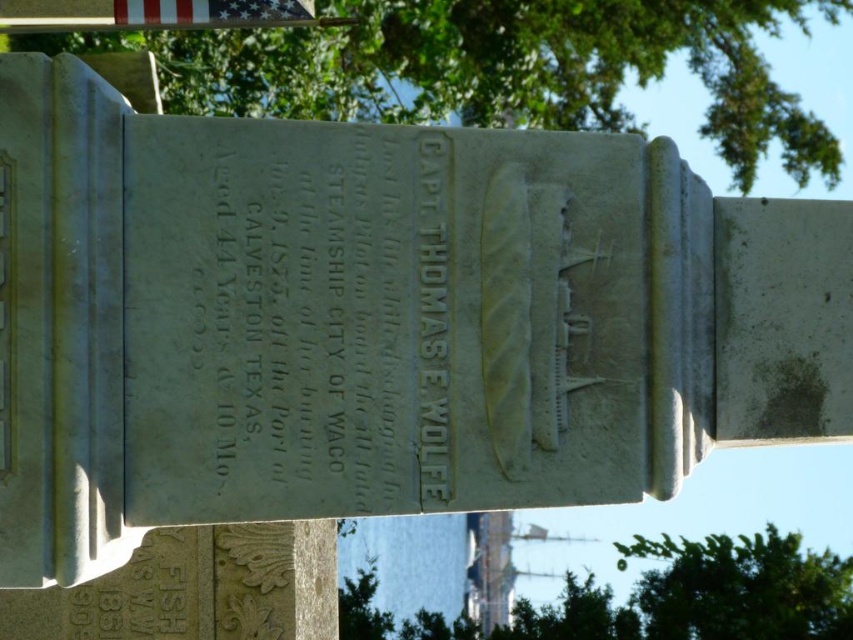
Question: Observing the image, what is the correct spatial positioning of green leafy tree at upper center in reference to silky fabric flag at upper left?

Choices:
 (A) above
 (B) below

Answer: (A)

Question: Which object is closer to the camera taking this photo?

Choices:
 (A) green leafy tree at upper center
 (B) silky fabric flag at upper left
 (C) green leafy tree at center

Answer: (B)

Question: Can you confirm if green leafy tree at upper center is wider than green leafy tree at center?

Choices:
 (A) no
 (B) yes

Answer: (B)

Question: Can you confirm if green leafy tree at upper center is thinner than green leafy tree at center?

Choices:
 (A) yes
 (B) no

Answer: (B)

Question: Which object is closer to the camera taking this photo?

Choices:
 (A) silky fabric flag at upper left
 (B) green leafy tree at center

Answer: (A)

Question: Based on their relative distances, which object is farther from the green leafy tree at center?

Choices:
 (A) silky fabric flag at upper left
 (B) green leafy tree at upper center

Answer: (A)